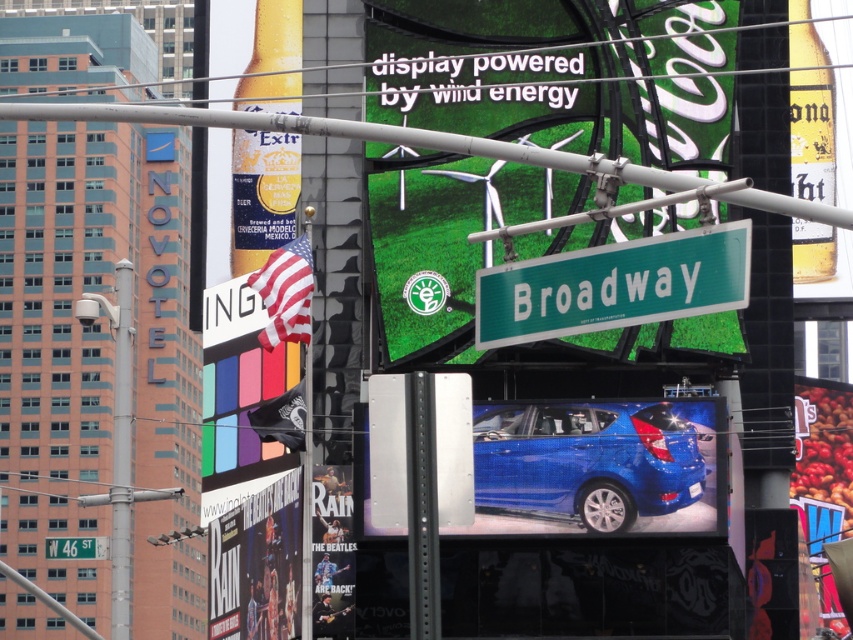
Question: Does matte yellow glass bottle at upper right lie in front of green metallic street sign at lower left?

Choices:
 (A) yes
 (B) no

Answer: (B)

Question: Is matte black poster at lower left further to camera compared to matte yellow glass bottle at upper right?

Choices:
 (A) no
 (B) yes

Answer: (A)

Question: Which of these objects is positioned farthest from the green metallic street sign at lower left?

Choices:
 (A) glossy blue hatchback at center
 (B) matte black poster at lower left
 (C) green plastic street sign at center
 (D) matte yellow glass bottle at upper right

Answer: (C)

Question: Does green matte signboard at center appear under glossy blue hatchback at center?

Choices:
 (A) yes
 (B) no

Answer: (B)

Question: Estimate the real-world distances between objects in this image. Which object is farther from the matte yellow glass bottle at upper right?

Choices:
 (A) matte black poster at lower left
 (B) green plastic street sign at center
 (C) green matte signboard at center

Answer: (B)

Question: Which of the following is the farthest from the observer?

Choices:
 (A) (234, 579)
 (B) (637, 465)

Answer: (A)